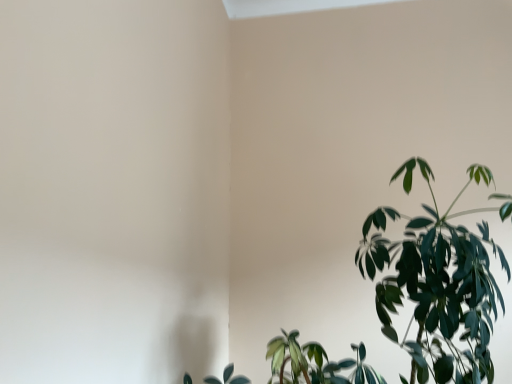
You are a GUI agent. You are given a task and a screenshot of the screen. Output one action in this format:
    pyautogui.click(x=<x>, y=<y>)
    Task: Click on the green matte plant at lower right
    The height and width of the screenshot is (384, 512).
    Given the screenshot: What is the action you would take?
    pyautogui.click(x=438, y=282)

The image size is (512, 384). Describe the element at coordinates (438, 282) in the screenshot. I see `green matte plant at lower right` at that location.

Where is `green matte plant at lower right`? green matte plant at lower right is located at coordinates (438, 282).